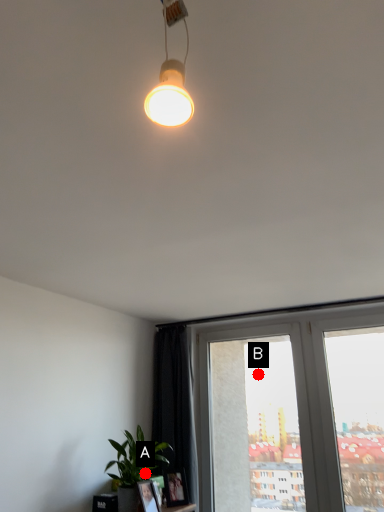
Question: Two points are circled on the image, labeled by A and B beside each circle. Which point is further to the camera?

Choices:
 (A) A is further
 (B) B is further

Answer: (B)